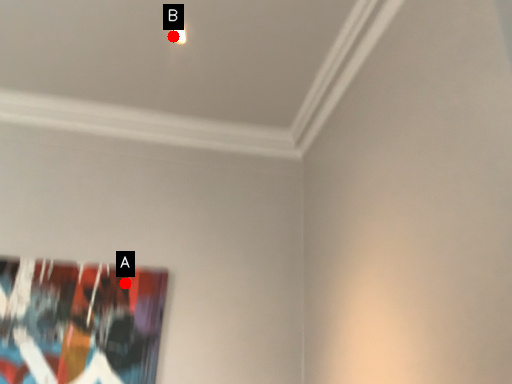
Question: Two points are circled on the image, labeled by A and B beside each circle. Which of the following is the closest to the observer?

Choices:
 (A) A is closer
 (B) B is closer

Answer: (B)